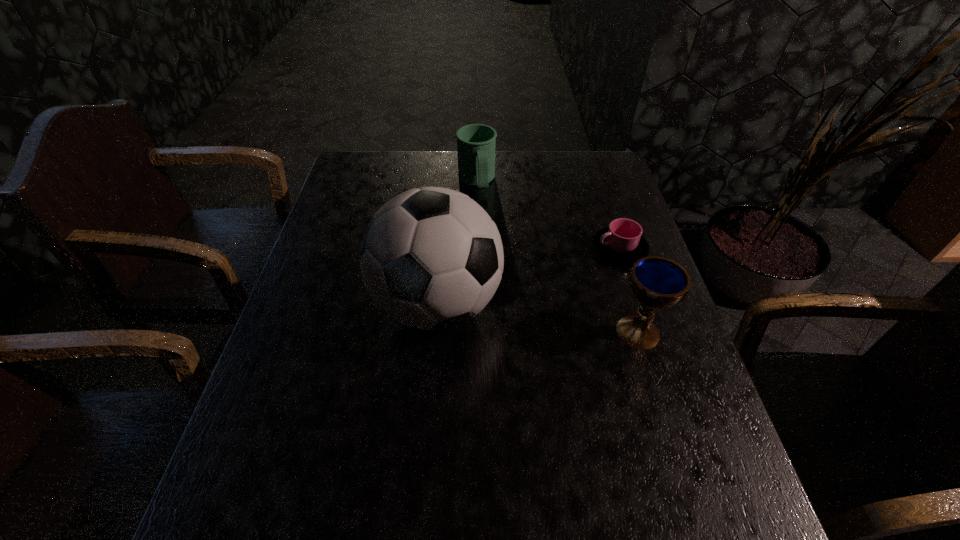
Locate an element on the screen. The width and height of the screenshot is (960, 540). vacant space at the far left corner is located at coordinates (382, 159).

Locate an element on the screen. The width and height of the screenshot is (960, 540). unoccupied position between the cup and the third shortest object is located at coordinates (629, 291).

The image size is (960, 540). I want to click on vacant space in between the cup and the second tallest object, so click(x=629, y=291).

Identify the location of free spot between the cup and the tallest object. (529, 277).

Find the location of a particular element. The image size is (960, 540). blank region between the chalice and the shortest object is located at coordinates (629, 291).

The width and height of the screenshot is (960, 540). What are the coordinates of `free space between the cup and the tallest object` in the screenshot? It's located at (529, 277).

This screenshot has height=540, width=960. I want to click on vacant area that lies between the third shortest object and the mug, so click(557, 256).

In order to click on empty location between the chalice and the tallest object in this screenshot , I will do `click(538, 318)`.

Identify the location of the closest object relative to the tallest object. The height and width of the screenshot is (540, 960). (657, 283).

Locate which object is the second closest to the shortest object. Please provide its 2D coordinates. Your answer should be formatted as a tuple, i.e. [(x, y)], where the tuple contains the x and y coordinates of a point satisfying the conditions above.

[(431, 258)]